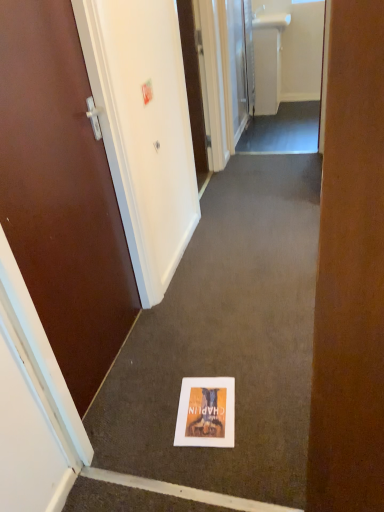
Question: Is white glossy sink at upper center wider or thinner than matte paper flyer at center?

Choices:
 (A) thin
 (B) wide

Answer: (A)

Question: From the image's perspective, is white glossy sink at upper center located above or below matte paper flyer at center?

Choices:
 (A) below
 (B) above

Answer: (B)

Question: Which object is the closest to the brown wooden door at left, positioned as the 2th door in back-to-front order?

Choices:
 (A) white glossy sink at upper center
 (B) matte paper flyer at center
 (C) white plastic sink at upper center
 (D) white glossy door at upper center, the 1th door from the top

Answer: (B)

Question: Which of these objects is positioned farthest from the white plastic sink at upper center?

Choices:
 (A) brown wooden door at left, placed as the 1th door when sorted from left to right
 (B) white glossy sink at upper center
 (C) matte paper flyer at center
 (D) white glossy door at upper center, which is the second door in left-to-right order

Answer: (C)